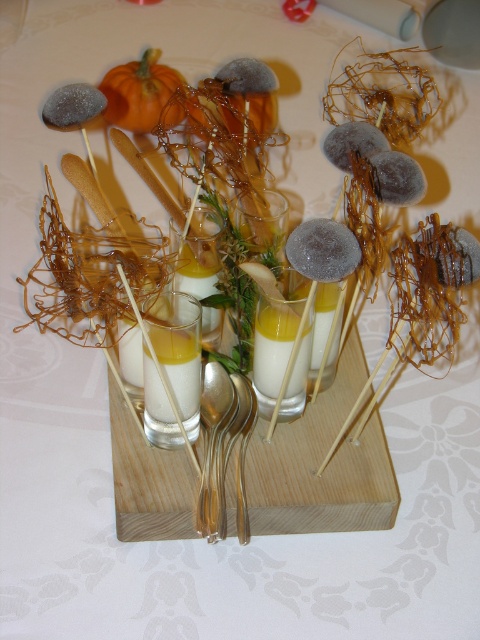
You are a guest at a dinner party and see the gold metallic spoon at center and the yellow translucent liquid at center on the tray. According to the arrangement, which object is positioned to the right of the other?

The yellow translucent liquid at center is to the right of the gold metallic spoon at center because the spoon is to the left of the liquid.

You are a guest at a dinner party and want to use the gold metallic spoon at center to stir the yellow translucent juice at center. Is the spoon long enough to reach the bottom of the juice?

The gold metallic spoon at center is much taller than the yellow translucent juice at center, so yes, the spoon is long enough to reach the bottom of the yellow translucent juice at center.

You are standing at a distance of 20 inches from the wooden tray. You want to reach the point marked as point [158,353] on the tray. Can you comfortably reach it without moving your position?

The point [158,353] is 19.07 inches from the viewer. Since you are standing 20 inches away from the wooden tray, you can comfortably reach it without moving your position.